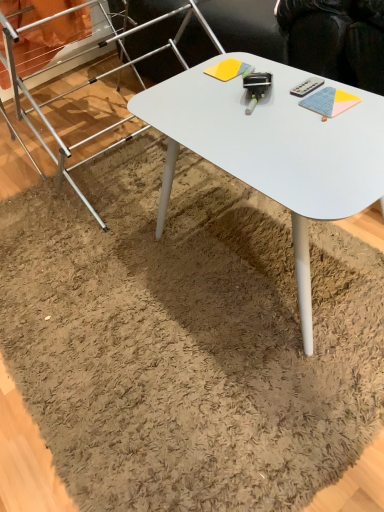
Where is `space that is in front of textured blue notepad at upper right, marked as the 2th notepad in a left-to-right arrangement`? Image resolution: width=384 pixels, height=512 pixels. space that is in front of textured blue notepad at upper right, marked as the 2th notepad in a left-to-right arrangement is located at coordinates (338, 144).